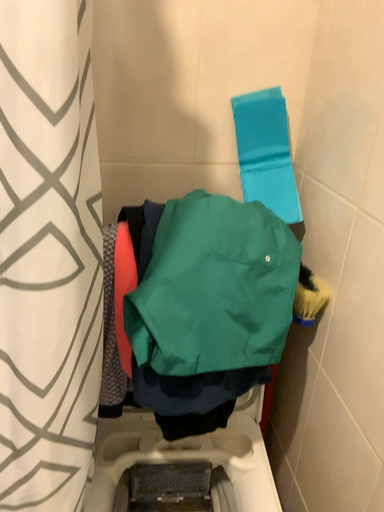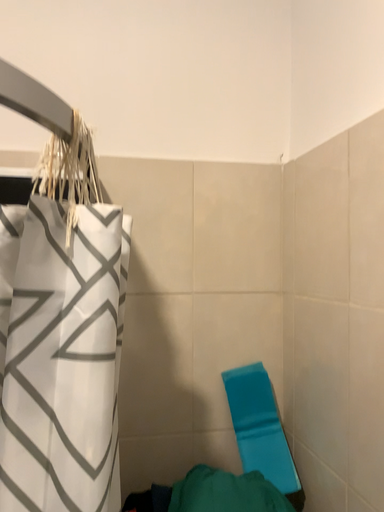
Question: How did the camera likely rotate when shooting the video?

Choices:
 (A) rotated upward
 (B) rotated downward

Answer: (A)